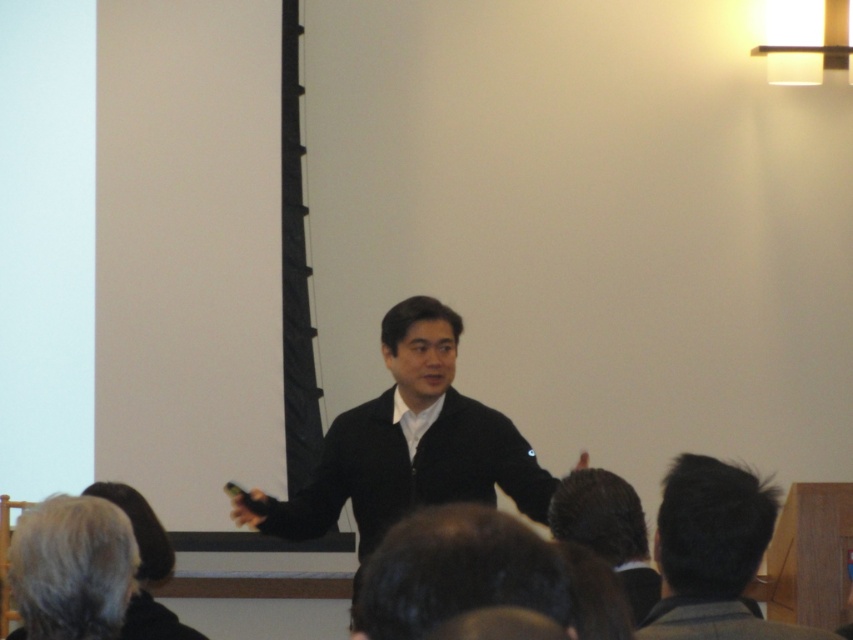
Can you confirm if dark brown hair at lower right is positioned to the left of gray hair at lower left?

In fact, dark brown hair at lower right is to the right of gray hair at lower left.

Is dark brown hair at lower right thinner than gray hair at lower left?

In fact, dark brown hair at lower right might be wider than gray hair at lower left.

Does point (712, 634) come farther from viewer compared to point (16, 602)?

No.

Locate an element on the screen. The image size is (853, 640). dark brown hair at lower right is located at coordinates (712, 554).

From the picture: Which of these two, black matte sweater at center or gray hair at lower left, stands taller?

With more height is black matte sweater at center.

Does point (544, 509) come closer to viewer compared to point (68, 627)?

No, (544, 509) is further to viewer.

Who is more distant from viewer, (349, 492) or (57, 540)?

Point (349, 492)

Find the location of `black matte sweater at center`. black matte sweater at center is located at coordinates (409, 444).

Can you confirm if black matte sweater at center is smaller than dark brown hair at lower right?

Incorrect, black matte sweater at center is not smaller in size than dark brown hair at lower right.

Is black matte sweater at center to the right of dark brown hair at lower right from the viewer's perspective?

No, black matte sweater at center is not to the right of dark brown hair at lower right.

Is point (378, 420) closer to viewer compared to point (683, 577)?

No.

In order to click on black matte sweater at center in this screenshot , I will do `click(409, 444)`.